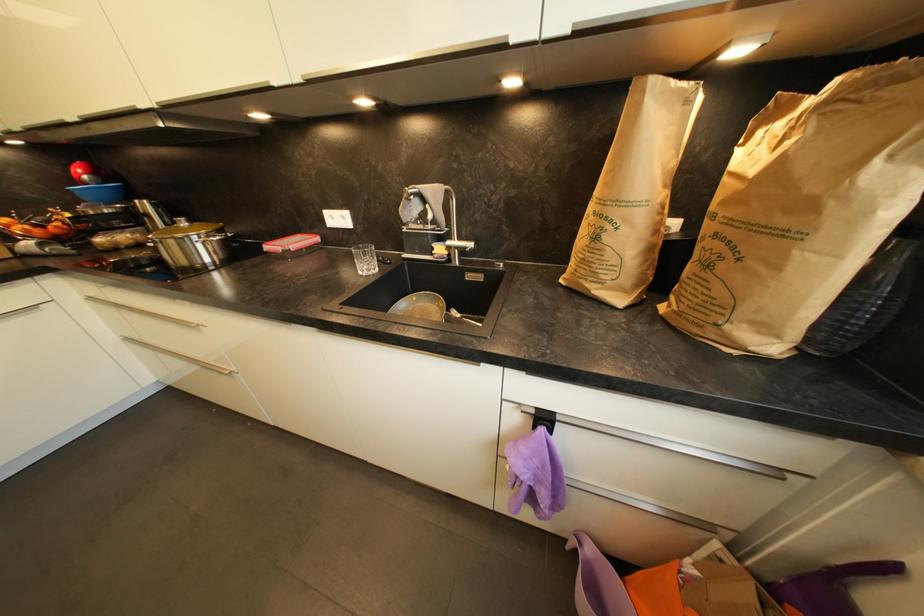
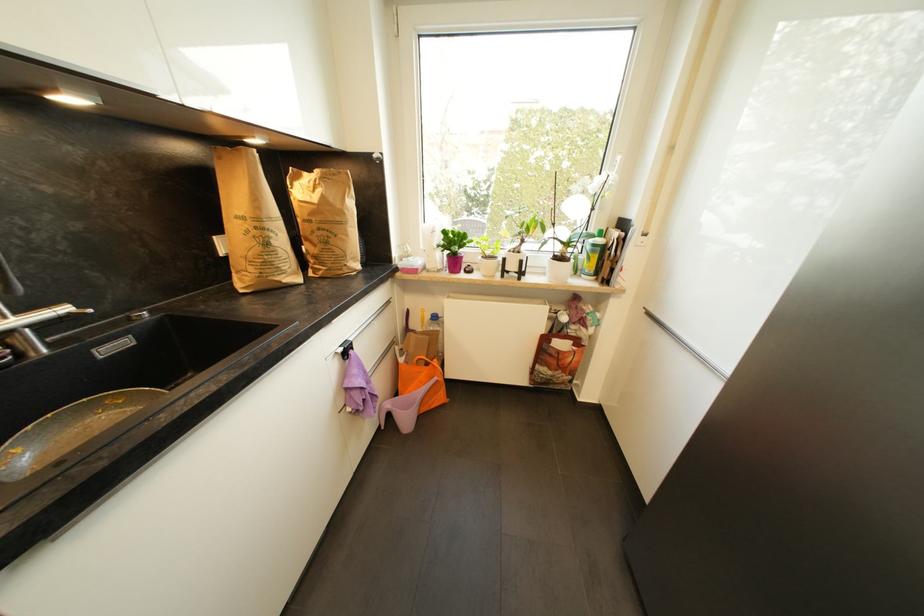
Where in the second image is the point corresponding to (x=538, y=413) from the first image?

(346, 351)